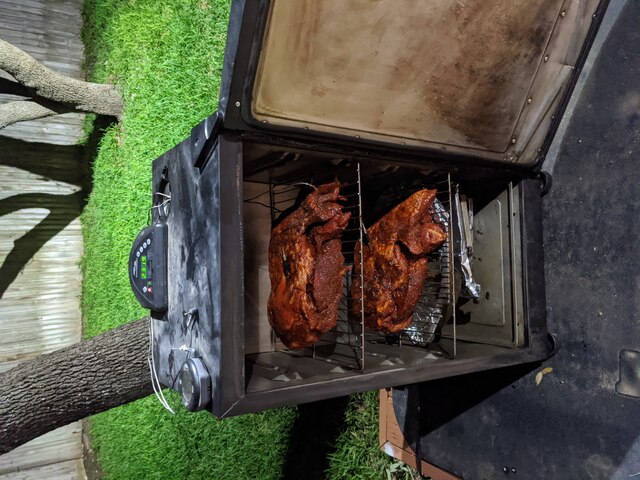
The width and height of the screenshot is (640, 480). In order to click on door in this screenshot , I will do point(589,272).